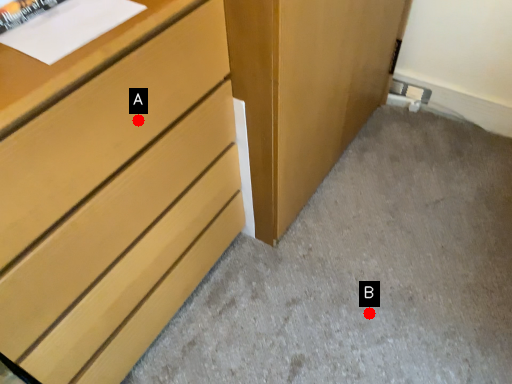
Question: Two points are circled on the image, labeled by A and B beside each circle. Which of the following is the closest to the observer?

Choices:
 (A) A is closer
 (B) B is closer

Answer: (A)